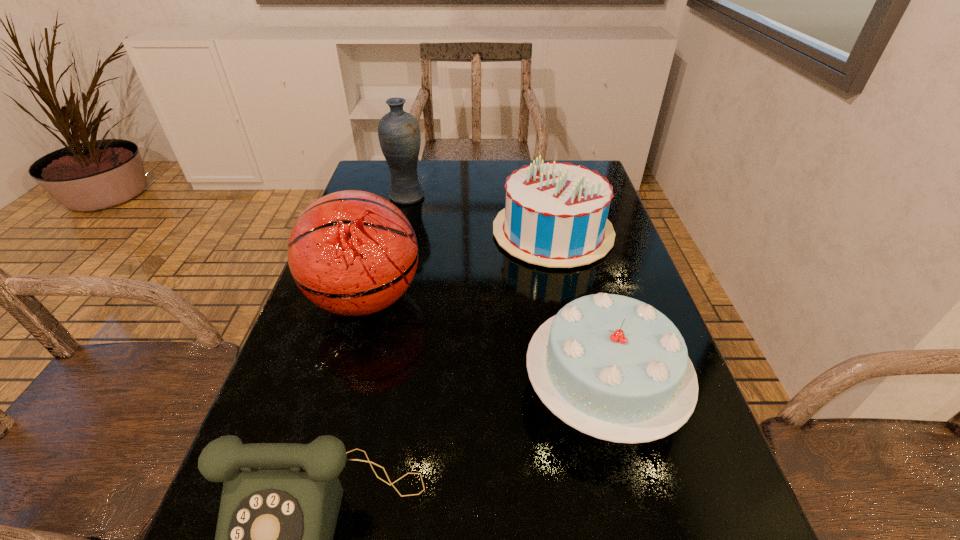
At what (x,y) coordinates should I click in order to perform the action: click on vase. Please return your answer as a coordinate pair (x, y). Looking at the image, I should click on pos(399,135).

Where is `basketball`? The height and width of the screenshot is (540, 960). basketball is located at coordinates (353, 253).

Locate an element on the screen. the farther birthday cake is located at coordinates (555, 215).

At what (x,y) coordinates should I click in order to perform the action: click on the nearer birthday cake. Please return your answer as a coordinate pair (x, y). Looking at the image, I should click on 613,367.

Find the location of a particular element. free space located 0.340m on the front of the vase is located at coordinates (385, 286).

In order to click on free space located on the side with spill of the basketball in this screenshot , I will do `click(445, 299)`.

The height and width of the screenshot is (540, 960). In order to click on vacant area situated on the back of the farther birthday cake in this screenshot , I will do `click(540, 170)`.

This screenshot has width=960, height=540. Find the location of `free spot located 0.350m on the left of the nearer birthday cake`. free spot located 0.350m on the left of the nearer birthday cake is located at coordinates (331, 390).

Where is `object situated at the far edge`? This screenshot has height=540, width=960. object situated at the far edge is located at coordinates (399, 135).

You are a GUI agent. You are given a task and a screenshot of the screen. Output one action in this format:
    pyautogui.click(x=<x>, y=<y>)
    Task: Click on the vase present at the left edge
    
    Given the screenshot: What is the action you would take?
    pyautogui.click(x=399, y=135)